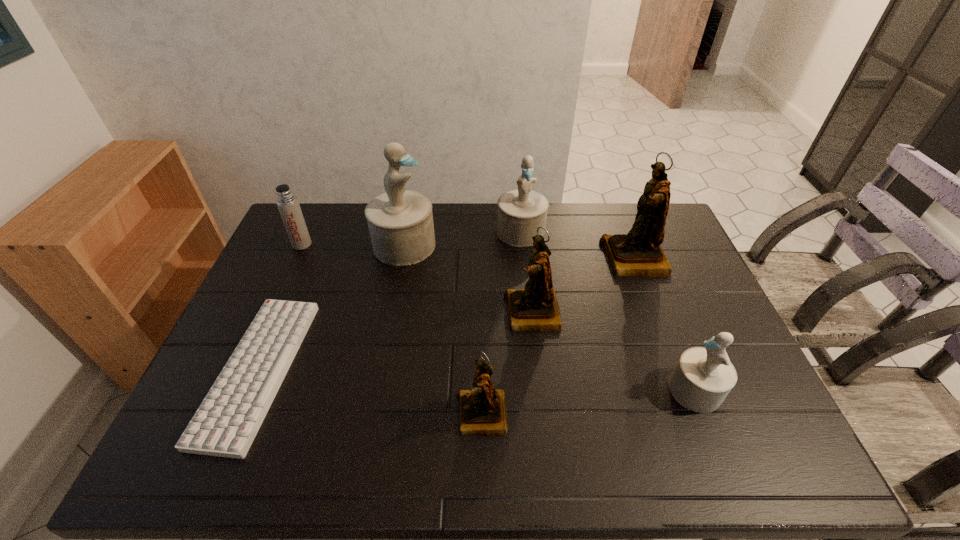
Where is `blank area located on the front-facing side of the second nearest gold figurine`? blank area located on the front-facing side of the second nearest gold figurine is located at coordinates (464, 313).

Locate an element on the screen. This screenshot has width=960, height=540. vacant region located 0.270m on the right of the thermos bottle is located at coordinates (390, 244).

At what (x,y) coordinates should I click in order to perform the action: click on free space located 0.330m at the beak of the nearest white figurine. Please return your answer as a coordinate pair (x, y). Looking at the image, I should click on (539, 390).

This screenshot has width=960, height=540. I want to click on free spot located at the beak of the nearest white figurine, so click(x=526, y=390).

This screenshot has height=540, width=960. Identify the location of vacant area located at the beak of the nearest white figurine. (542, 390).

At what (x,y) coordinates should I click in order to perform the action: click on vacant space positioned 0.270m on the front-facing side of the leftmost gold figurine. Please return your answer as a coordinate pair (x, y). Image resolution: width=960 pixels, height=540 pixels. Looking at the image, I should click on (344, 415).

Locate an element on the screen. The width and height of the screenshot is (960, 540). free point located on the front-facing side of the leftmost gold figurine is located at coordinates (302, 415).

Image resolution: width=960 pixels, height=540 pixels. Find the location of `vacant space located on the front-facing side of the leftmost gold figurine`. vacant space located on the front-facing side of the leftmost gold figurine is located at coordinates (394, 415).

Locate an element on the screen. blank space located 0.310m on the back of the shortest object is located at coordinates (314, 239).

This screenshot has height=540, width=960. In order to click on thermos bottle that is at the far edge in this screenshot , I will do `click(287, 203)`.